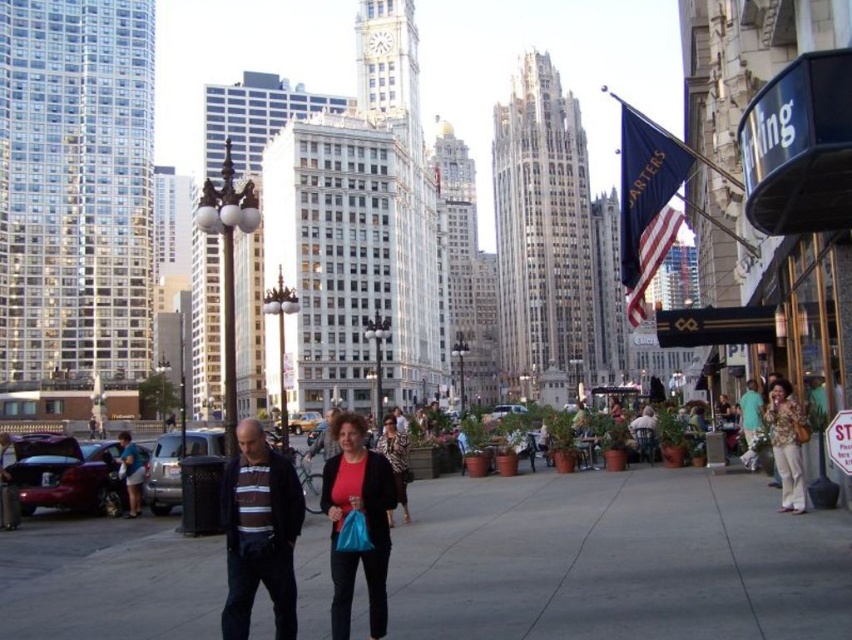
Question: Does striped knit sweater at center come behind patterned fabric dress at center?

Choices:
 (A) yes
 (B) no

Answer: (B)

Question: Which point is farther from the camera taking this photo?

Choices:
 (A) (350, 561)
 (B) (383, 445)
 (C) (611, 557)

Answer: (B)

Question: Is the position of green cotton shirt at lower right less distant than that of striped sweater at center?

Choices:
 (A) yes
 (B) no

Answer: (B)

Question: Which is farther from the striped knit sweater at center?

Choices:
 (A) floral-patterned blouse at center
 (B) striped sweater at center
 (C) green cotton shirt at lower right
 (D) matte red shirt at center

Answer: (C)

Question: Among these objects, which one is farthest from the camera?

Choices:
 (A) striped knit sweater at center
 (B) green cotton shirt at lower right

Answer: (B)

Question: Is floral-patterned blouse at center above patterned fabric dress at center?

Choices:
 (A) yes
 (B) no

Answer: (A)